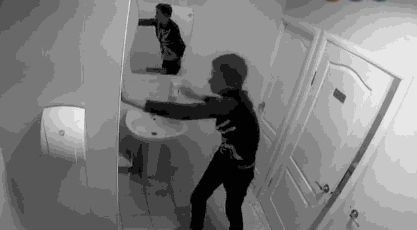
You are a GUI agent. You are given a task and a screenshot of the screen. Output one action in this format:
    pyautogui.click(x=<x>, y=<y>)
    Task: Click on the mirror
    This screenshot has height=230, width=417.
    Given the screenshot: What is the action you would take?
    pyautogui.click(x=176, y=27)